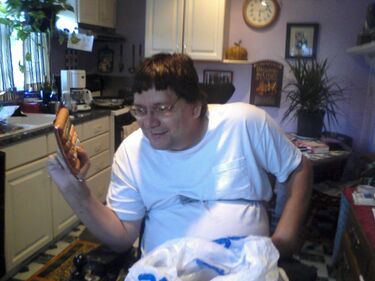
This screenshot has width=375, height=281. I want to click on window, so click(17, 61).